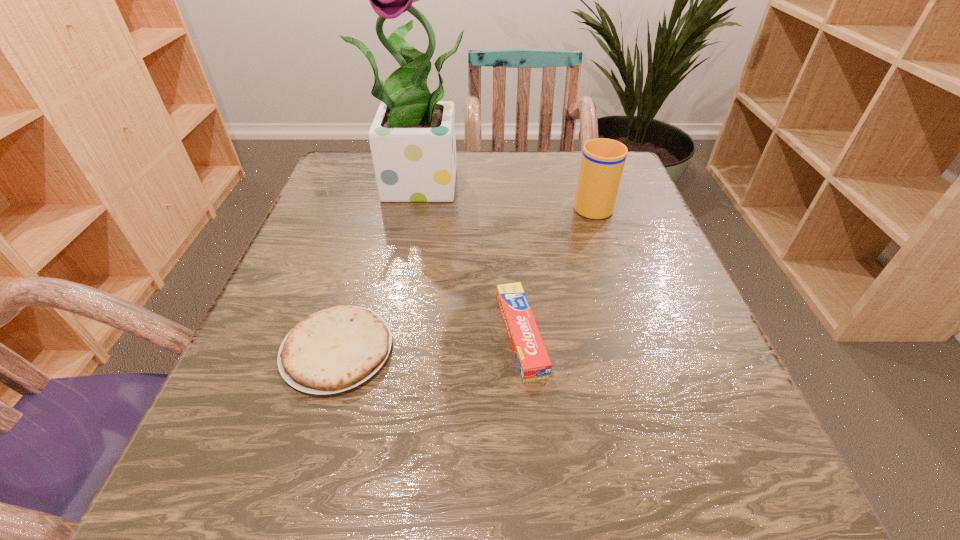
The width and height of the screenshot is (960, 540). In order to click on vacant space located on the right of the toothpaste in this screenshot , I will do `click(582, 335)`.

The width and height of the screenshot is (960, 540). What are the coordinates of `free location located 0.400m on the back of the shortest object` in the screenshot? It's located at (386, 183).

The height and width of the screenshot is (540, 960). In order to click on flower arrangement situated at the far edge in this screenshot , I will do `click(412, 139)`.

Image resolution: width=960 pixels, height=540 pixels. In order to click on cup that is at the far edge in this screenshot , I will do pyautogui.click(x=602, y=163).

This screenshot has width=960, height=540. Find the location of `flower arrangement that is positioned at the left edge`. flower arrangement that is positioned at the left edge is located at coordinates (412, 139).

Locate an element on the screen. The image size is (960, 540). tortilla located at the left edge is located at coordinates (336, 349).

Where is `object that is at the right edge`? This screenshot has height=540, width=960. object that is at the right edge is located at coordinates (602, 163).

Where is `object at the far left corner`? The width and height of the screenshot is (960, 540). object at the far left corner is located at coordinates (412, 139).

The width and height of the screenshot is (960, 540). Find the location of `object present at the far right corner`. object present at the far right corner is located at coordinates (602, 163).

In the image, there is a desktop. Identify the location of vacant area at the far edge. (525, 171).